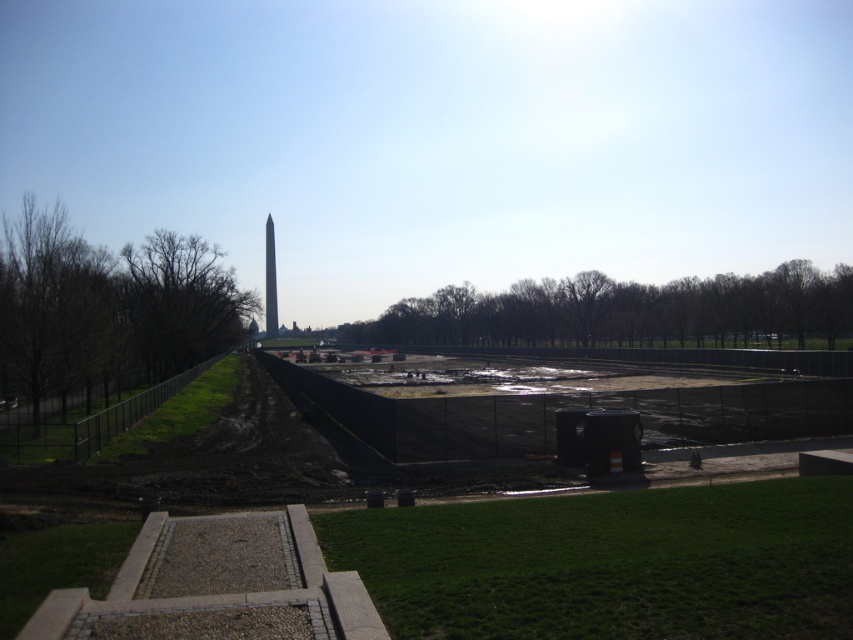
Question: In this image, where is black matte construction site at center located relative to polished granite obelisk at center?

Choices:
 (A) above
 (B) below

Answer: (B)

Question: Among these objects, which one is nearest to the camera?

Choices:
 (A) polished granite obelisk at center
 (B) black matte construction site at center

Answer: (B)

Question: Can you confirm if black matte construction site at center is positioned to the left of polished granite obelisk at center?

Choices:
 (A) yes
 (B) no

Answer: (B)

Question: Does black matte construction site at center come behind polished granite obelisk at center?

Choices:
 (A) no
 (B) yes

Answer: (A)

Question: Among these points, which one is nearest to the camera?

Choices:
 (A) (265, 237)
 (B) (96, 456)

Answer: (B)